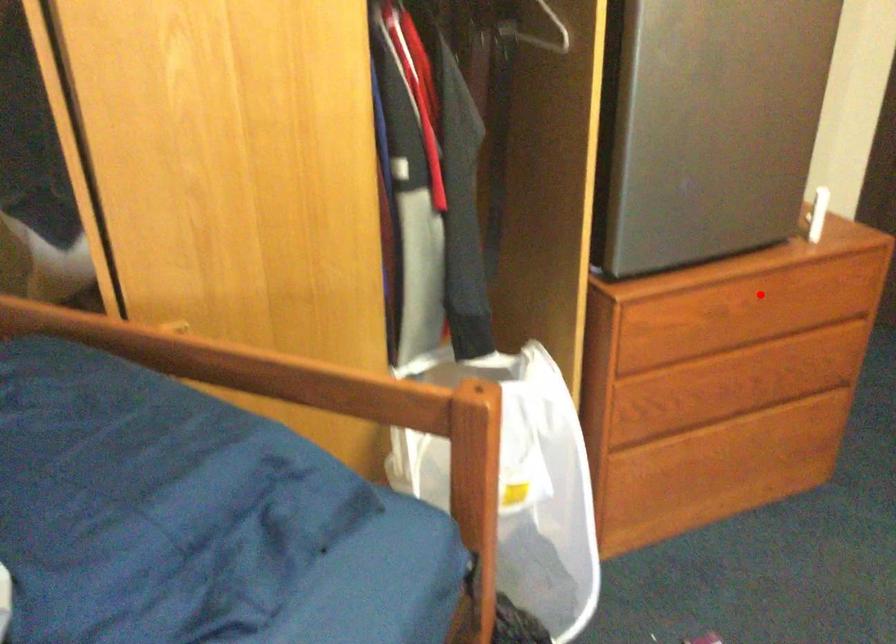
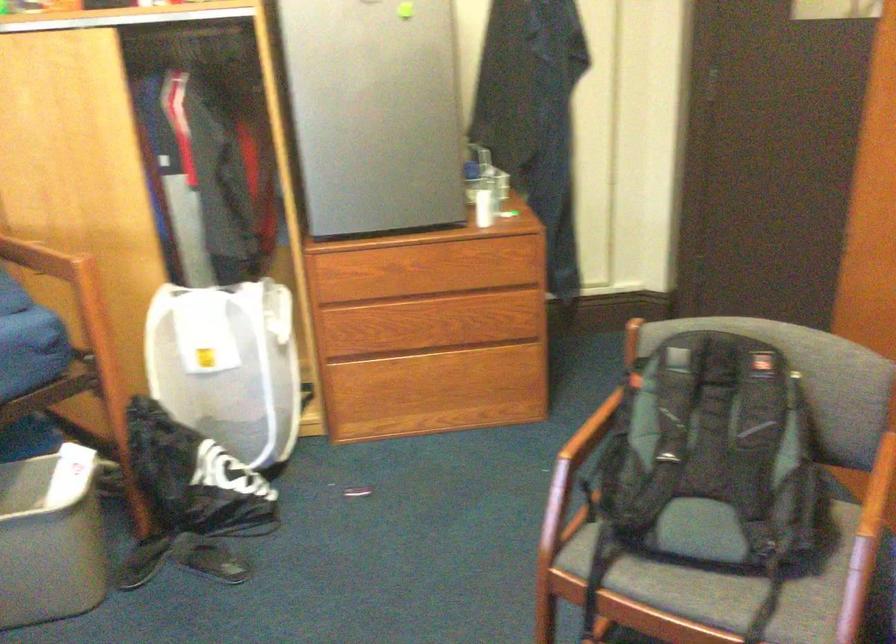
Question: I am providing you with two images of the same scene from different viewpoints. Given a red point in image1, look at the same physical point in image2. Is it:

Choices:
 (A) Closer to the viewpoint
 (B) Farther from the viewpoint

Answer: (B)